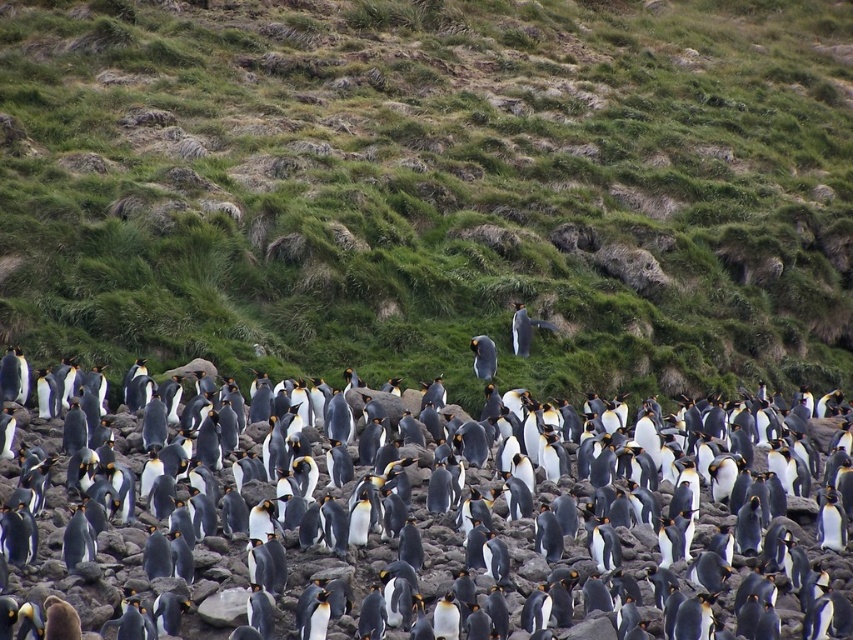
You are a penguin standing on the white fluffy penguin at center and want to reach the green grassy hillside at upper center. Which direction should you walk to get there?

The green grassy hillside at upper center is located above the white fluffy penguin at center, so you should walk upward to reach it.